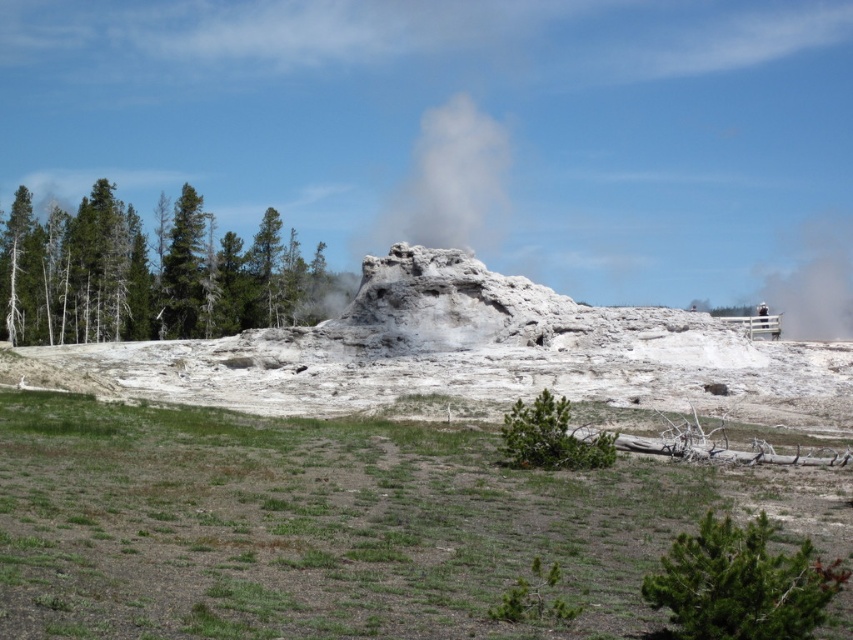
Question: Observing the image, what is the correct spatial positioning of green coniferous trees at left in reference to green rough bark tree at lower right?

Choices:
 (A) left
 (B) right

Answer: (A)

Question: Among these points, which one is nearest to the camera?

Choices:
 (A) (456, 166)
 (B) (173, 228)
 (C) (676, 538)

Answer: (C)

Question: Does green coniferous trees at left come in front of green rough bark tree at lower right?

Choices:
 (A) yes
 (B) no

Answer: (B)

Question: Is green rough bark tree at lower right to the left of white/translucent steam at center from the viewer's perspective?

Choices:
 (A) yes
 (B) no

Answer: (B)

Question: Which point is closer to the camera?

Choices:
 (A) (117, 211)
 (B) (718, 582)

Answer: (B)

Question: Which object is the farthest from the green coniferous trees at left?

Choices:
 (A) white/translucent steam at center
 (B) green rough bark tree at lower right

Answer: (B)